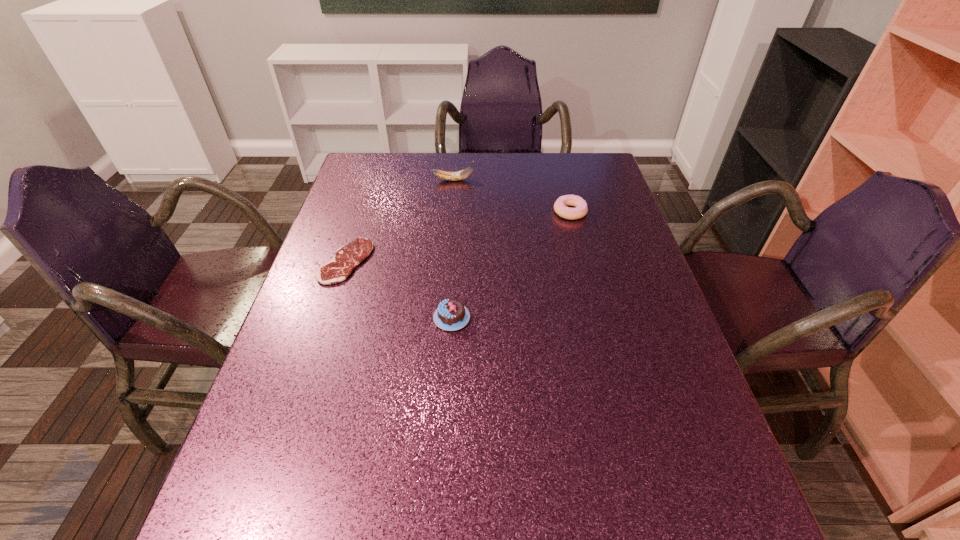
Locate an element on the screen. The image size is (960, 540). empty location between the shortest object and the chocolate cake is located at coordinates (398, 289).

Where is `unoccupied position between the banana and the nearest object`? The image size is (960, 540). unoccupied position between the banana and the nearest object is located at coordinates (453, 249).

Find the location of a particular element. unoccupied position between the chocolate cake and the second farthest object is located at coordinates (511, 265).

The height and width of the screenshot is (540, 960). I want to click on free space between the leftmost object and the farthest object, so click(x=399, y=221).

I want to click on free spot between the steak and the third nearest object, so click(x=458, y=237).

At what (x,y) coordinates should I click in order to perform the action: click on free area in between the banana and the second farthest object. Please return your answer as a coordinate pair (x, y). Image resolution: width=960 pixels, height=540 pixels. Looking at the image, I should click on (512, 196).

The height and width of the screenshot is (540, 960). Identify the location of empty space between the steak and the second shortest object. (458, 237).

Image resolution: width=960 pixels, height=540 pixels. I want to click on empty location between the doughnut and the nearest object, so click(511, 265).

The width and height of the screenshot is (960, 540). I want to click on empty space that is in between the second shortest object and the nearest object, so click(x=511, y=265).

The height and width of the screenshot is (540, 960). Find the location of `unoccupied area between the chocolate cake and the shortest object`. unoccupied area between the chocolate cake and the shortest object is located at coordinates (398, 289).